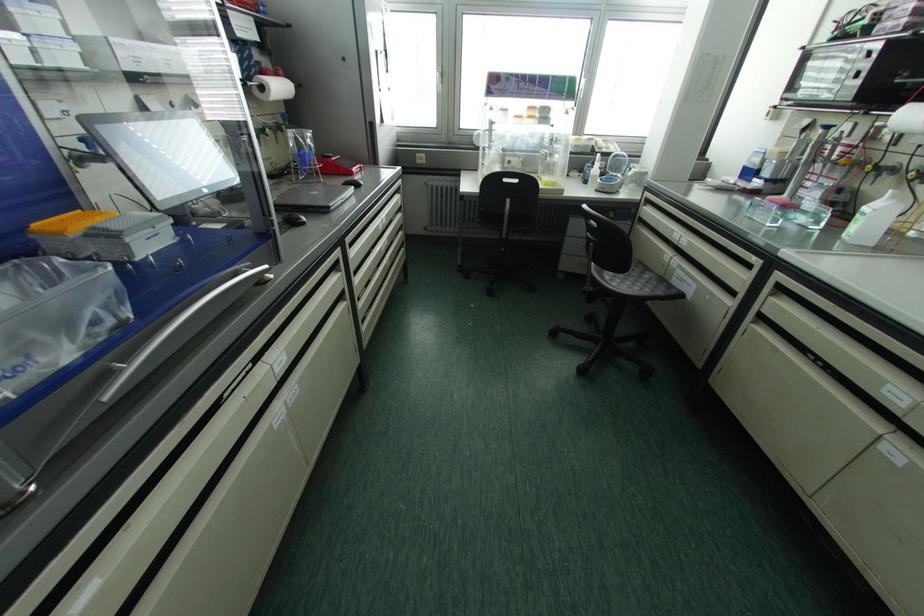
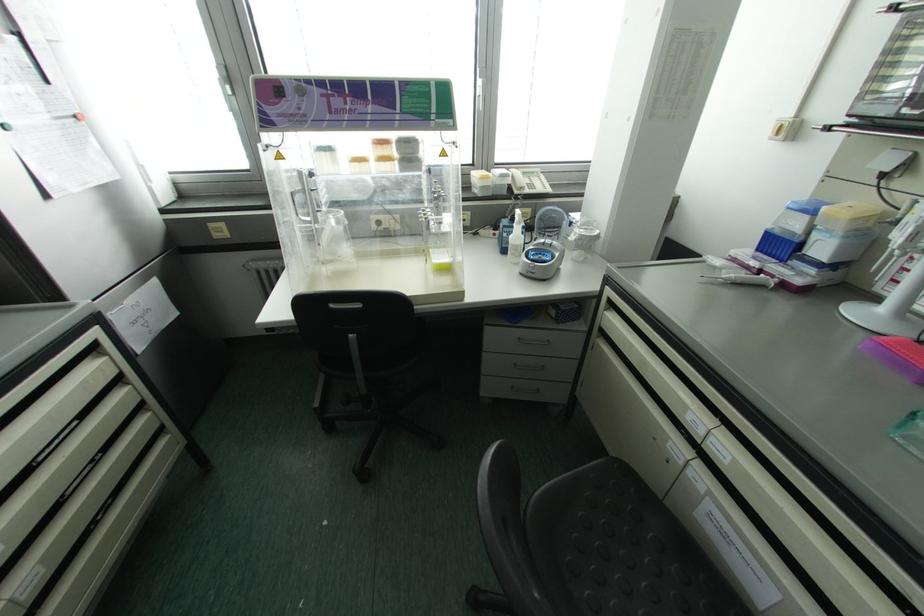
Where in the second image is the point corresponding to (x=594, y=169) from the first image?

(516, 235)